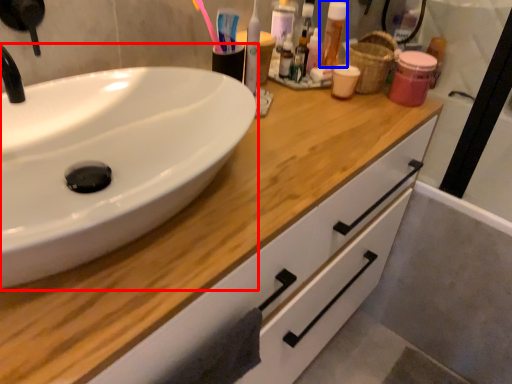
Question: Which point is closer to the camera, sink (highlighted by a red box) or mouthwash (highlighted by a blue box)?

Choices:
 (A) sink
 (B) mouthwash

Answer: (A)